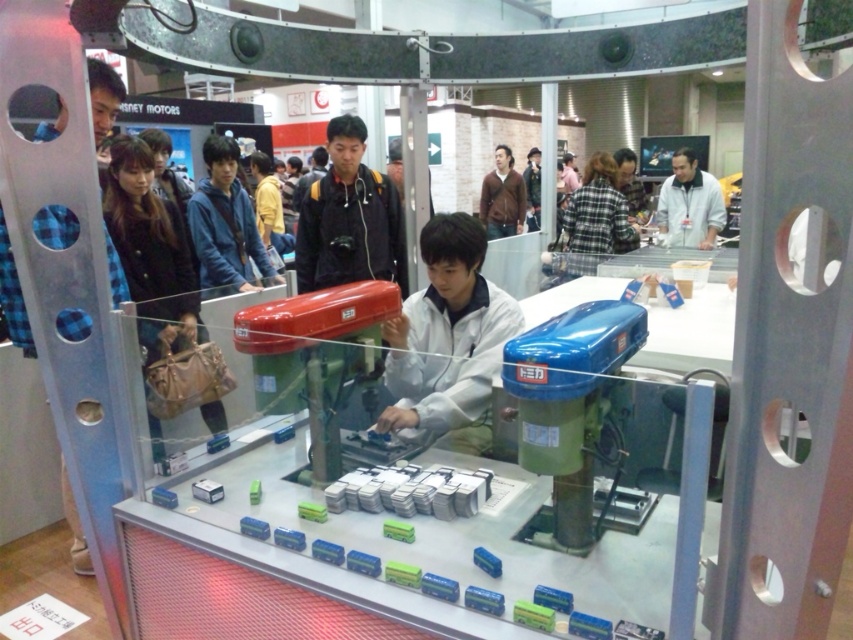
Question: Does blue plaid shirt at left have a larger size compared to plaid fabric shirt at center?

Choices:
 (A) no
 (B) yes

Answer: (B)

Question: Considering the real-world distances, which object is closest to the white matte jacket at upper right?

Choices:
 (A) plaid fabric shirt at center
 (B) brown leather jacket at upper center

Answer: (A)

Question: In this image, where is blue plaid shirt at left located relative to white matte jacket at upper right?

Choices:
 (A) below
 (B) above

Answer: (A)

Question: Estimate the real-world distances between objects in this image. Which object is closer to the dark blue jacket at center?

Choices:
 (A) leather handbag at left
 (B) white matte jacket at center

Answer: (A)

Question: Among these objects, which one is nearest to the camera?

Choices:
 (A) blue plaid shirt at left
 (B) dark blue jacket at center

Answer: (A)

Question: Does leather handbag at left have a greater width compared to blue plaid shirt at left?

Choices:
 (A) yes
 (B) no

Answer: (A)